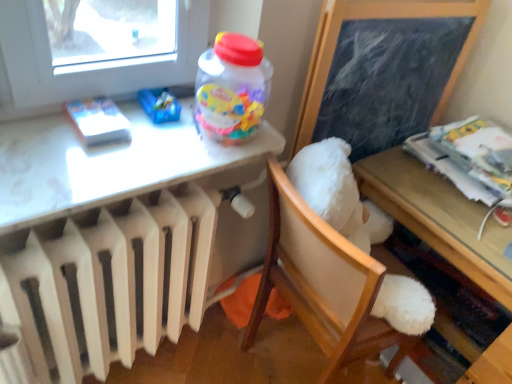
This screenshot has height=384, width=512. I want to click on free space to the left of white matte book at upper left, placed as the 2th magazine when sorted from right to left, so click(38, 137).